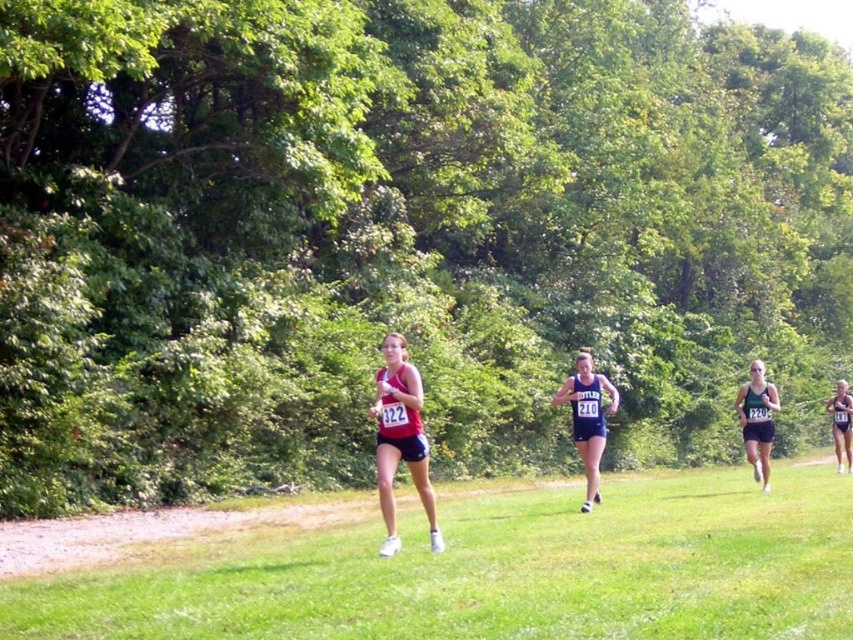
You are a race official trying to determine the order of runners based on their positions in the image. The image shows two runners represented by coordinates point (404, 362) and point (840, 435). Which runner is closer to the finish line?

Point (404, 362) is in front of point (840, 435), so the runner at point (404, 362) is closer to the finish line.

You are a race official trying to ensure runners are spaced properly for safety. The minimum required distance between runners is 50 feet. Based on the image, can you confirm whether the blue athletic uniform at center and the matte blue tank top at right are maintaining the required distance?

The blue athletic uniform at center is 51.18 feet from matte blue tank top at right, so yes, they are maintaining the required distance of at least 50 feet.

You are a photographer at the cross country race. You need to capture a photo of the two runners wearing black athletic wear at right and matte blue tank top at right. Which runner should you focus on if you want to avoid blurring due to their speed, considering their body size?

The black athletic wear at right is thinner than matte blue tank top at right, so focusing on the black athletic wear at right may be better as thinner runners might move faster and be harder to capture without blur.